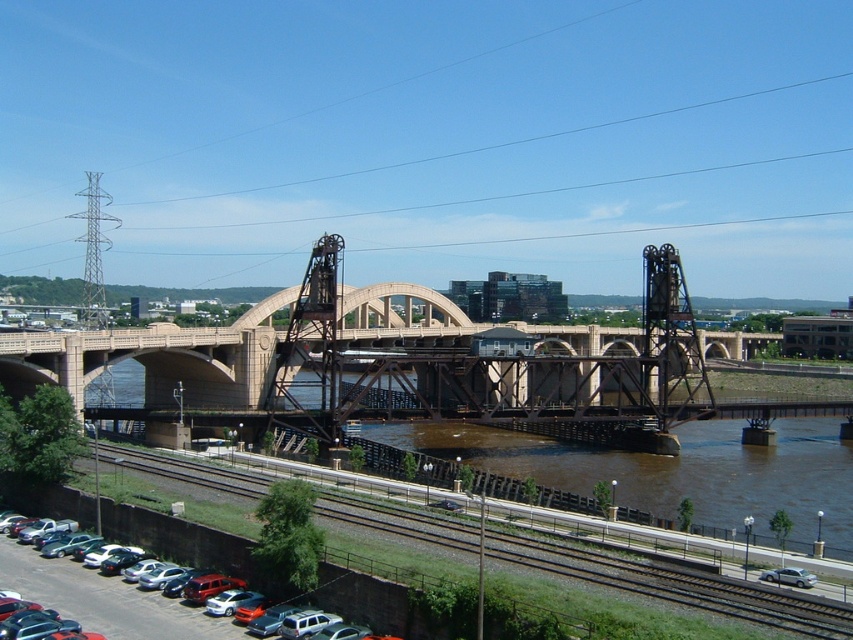
Is smooth asphalt train track at lower left above silver metallic sedan at lower left?

Yes, smooth asphalt train track at lower left is above silver metallic sedan at lower left.

Measure the distance between point (772, 595) and camera.

177.75 feet

Image resolution: width=853 pixels, height=640 pixels. What are the coordinates of `smooth asphalt train track at lower left` in the screenshot? It's located at (670, 580).

Can you confirm if silver metallic sedan at lower left is taller than silver metallic sedan at lower right?

Yes, silver metallic sedan at lower left is taller than silver metallic sedan at lower right.

Is point (74, 579) positioned after point (811, 584)?

Yes, it is behind point (811, 584).

Is point (219, 628) farther from viewer compared to point (782, 572)?

That is False.

Where is `silver metallic sedan at lower left`? silver metallic sedan at lower left is located at coordinates (102, 600).

Does smooth asphalt train track at lower left lie in front of silver metallic sedan at lower right?

Yes, smooth asphalt train track at lower left is closer to the viewer.

Between point (625, 561) and point (786, 573), which one is positioned behind?

The point (625, 561) is more distant.

This screenshot has height=640, width=853. What do you see at coordinates (670, 580) in the screenshot? I see `smooth asphalt train track at lower left` at bounding box center [670, 580].

The image size is (853, 640). I want to click on smooth asphalt train track at lower left, so click(x=670, y=580).